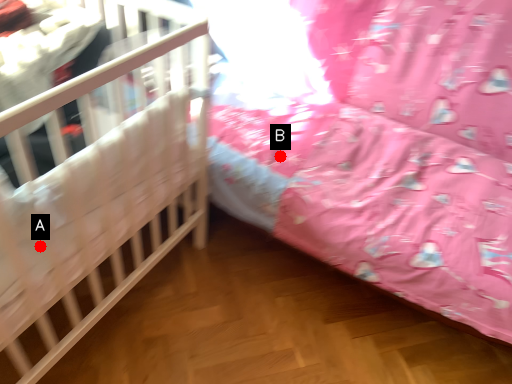
Question: Two points are circled on the image, labeled by A and B beside each circle. Among these points, which one is nearest to the camera?

Choices:
 (A) A is closer
 (B) B is closer

Answer: (A)